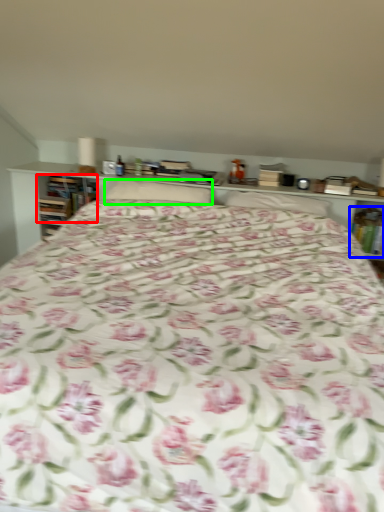
Question: Which object is positioned closest to book (highlighted by a red box)? Select from book (highlighted by a blue box) and pillow (highlighted by a green box).

Choices:
 (A) book
 (B) pillow

Answer: (B)